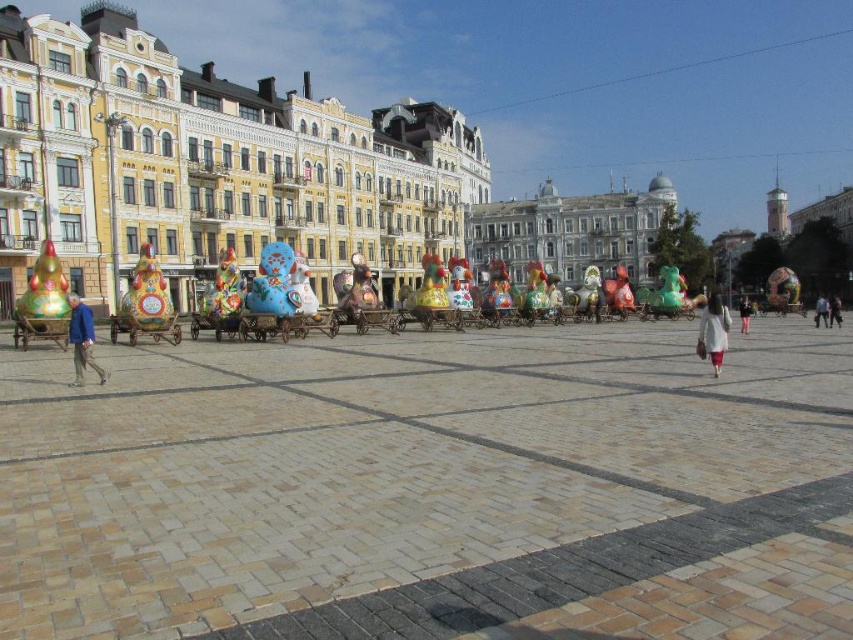
Question: Which point appears closest to the camera in this image?

Choices:
 (A) (78, 356)
 (B) (705, 310)
 (C) (822, 305)

Answer: (A)

Question: Does blue denim jeans at lower right appear over pink fabric dress at center?

Choices:
 (A) no
 (B) yes

Answer: (B)

Question: Does white cotton dress at center appear on the right side of blue denim jacket at left?

Choices:
 (A) no
 (B) yes

Answer: (B)

Question: Is white cotton dress at center bigger than pink fabric dress at center?

Choices:
 (A) yes
 (B) no

Answer: (A)

Question: Among these objects, which one is nearest to the camera?

Choices:
 (A) blue denim jacket at left
 (B) pink fabric dress at center
 (C) white cotton dress at center

Answer: (A)

Question: Estimate the real-world distances between objects in this image. Which object is farther from the pink fabric dress at center?

Choices:
 (A) blue denim jeans at lower right
 (B) white cotton dress at center
 (C) blue denim jacket at left

Answer: (C)